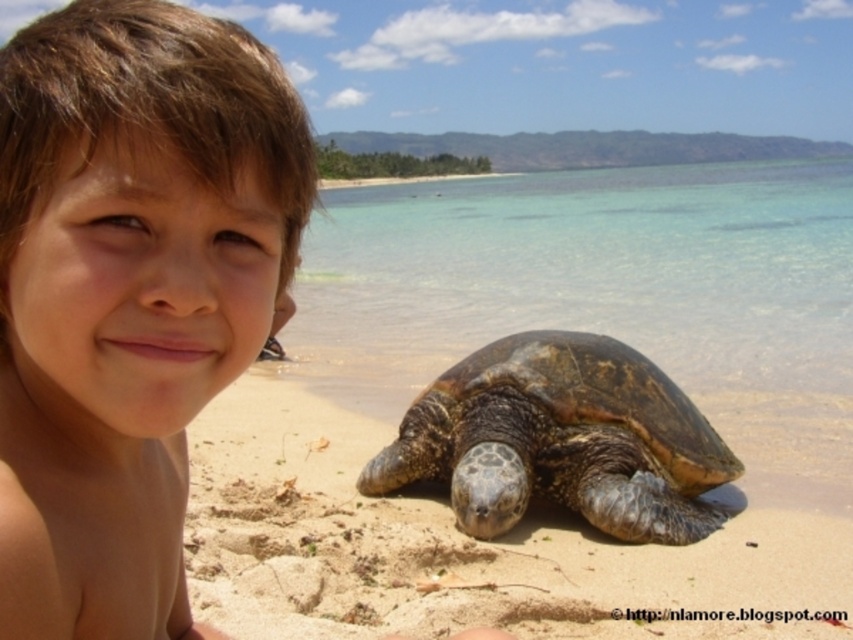
You are a photographer trying to capture a photo of the smooth skin child at center and the large sea turtle in the background. Based on their positions, can you determine if the turtle is closer to the camera than the child?

The smooth skin child at center is located at point (129,292), but without the turtle coordinates, we cannot determine the turtle position relative to the child. Please provide turtle coordinates for accurate assessment.

You are a photographer trying to capture a closeup shot of the smooth skin child at center and the brown sandy beach at lower center. Which object will appear larger in your photo?

The smooth skin child at center will appear larger in the photo because it is closer to the viewer than the brown sandy beach at lower center.